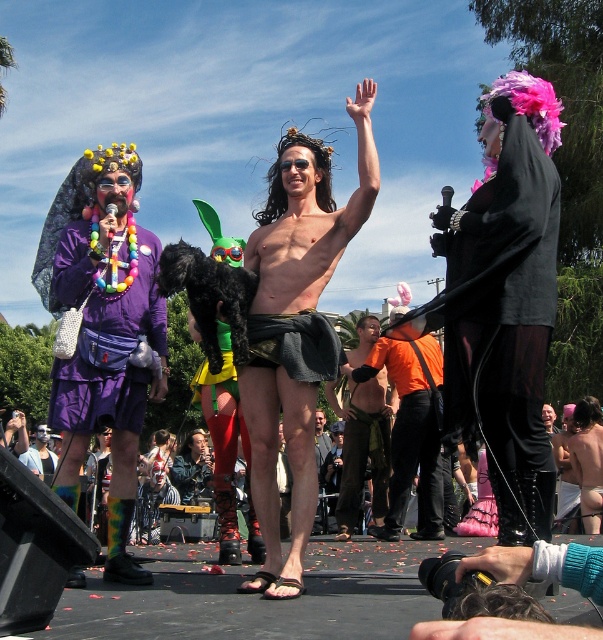
Does black leather gloves at right appear on the left side of purple fabric purse at left?

Incorrect, black leather gloves at right is not on the left side of purple fabric purse at left.

Can you confirm if black leather gloves at right is smaller than purple fabric purse at left?

Incorrect, black leather gloves at right is not smaller in size than purple fabric purse at left.

You are a GUI agent. You are given a task and a screenshot of the screen. Output one action in this format:
    pyautogui.click(x=<x>, y=<y>)
    Task: Click on the black leather gloves at right
    Image resolution: width=603 pixels, height=640 pixels.
    Given the screenshot: What is the action you would take?
    pyautogui.click(x=505, y=320)

Does matte purple dress at left have a larger size compared to orange fabric shorts at center?

Yes.

How distant is matte purple dress at left from orange fabric shorts at center?

They are 40.74 feet apart.

You are a GUI agent. You are given a task and a screenshot of the screen. Output one action in this format:
    pyautogui.click(x=<x>, y=<y>)
    Task: Click on the matte purple dress at left
    
    Given the screenshot: What is the action you would take?
    pyautogui.click(x=103, y=332)

Between purple fabric purse at left and orange matte shirt at center, which one has more height?

orange matte shirt at center is taller.

Is point (118, 417) positioned behind point (429, 385)?

No, (118, 417) is closer to viewer.

The image size is (603, 640). What are the coordinates of `purple fabric purse at left` in the screenshot? It's located at pos(96,396).